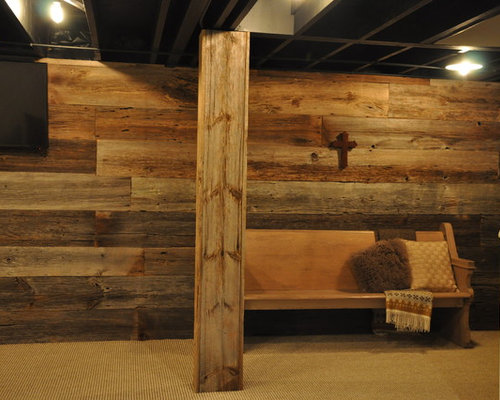
This screenshot has height=400, width=500. What are the coordinates of `televison` in the screenshot? It's located at (23, 107).